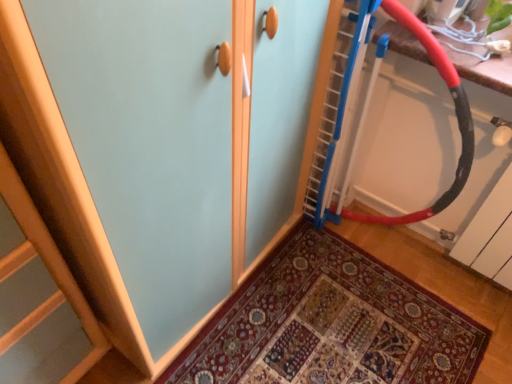
What are the coordinates of `free space below wooden door at center (from a real-world perspective)` in the screenshot? It's located at (336, 328).